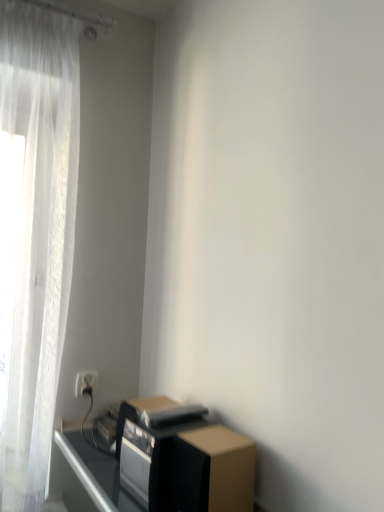
Question: Is black matte speaker at lower right taller or shorter than white plastic electric outlet at lower left?

Choices:
 (A) tall
 (B) short

Answer: (A)

Question: From the image's perspective, is black matte speaker at lower right above or below white plastic electric outlet at lower left?

Choices:
 (A) above
 (B) below

Answer: (B)

Question: Which object is the farthest from the brown cardboard box at lower right?

Choices:
 (A) white plastic electric outlet at lower left
 (B) black matte speaker at lower right

Answer: (A)

Question: Which object is positioned closest to the black matte speaker at lower right?

Choices:
 (A) brown cardboard box at lower right
 (B) white plastic electric outlet at lower left

Answer: (A)